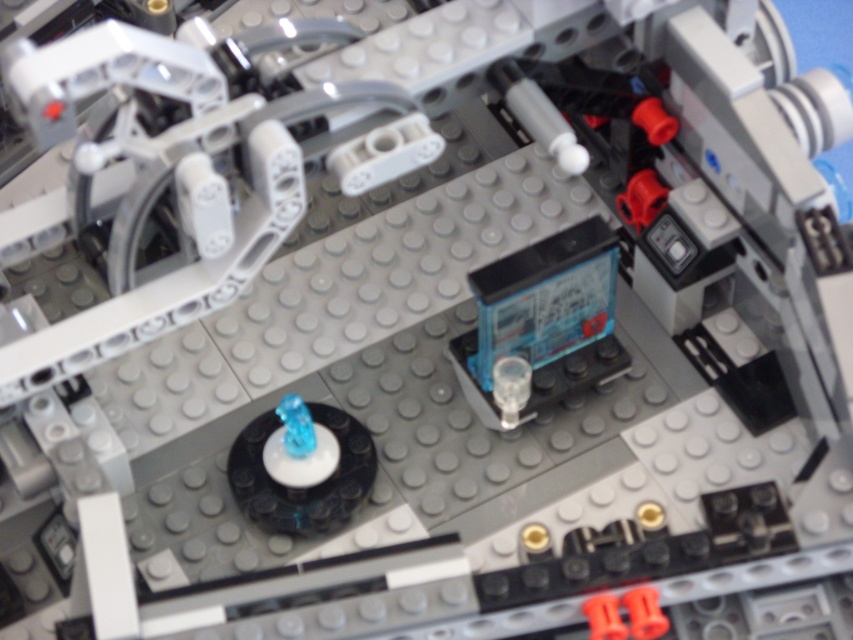
You are assembling a LEGO set and need to place the blue plastic battery at center and the translucent blue plastic bear at center. According to the instructions, which object should be placed first if the battery needs to be above the bear?

The translucent blue plastic bear at center should be placed first because the blue plastic battery at center is located above it, so the bear needs to be positioned below to support the battery.

You are a small robot that needs to recharge its battery. You see a blue plastic battery at center and a translucent blue plastic bear at center in the LEGO construction. Which object is closer to you if you are standing at the edge of the LEGO base?

The blue plastic battery at center is closer to you because it is positioned at the center of the LEGO base, while the translucent blue plastic bear at center is 9.68 inches away from the battery, making it farther from the edge where you are standing.

Looking at this image, you are a child trying to reach the blue plastic battery at center and the translucent blue plastic bear at center in the LEGO set. Which object is closer to you?

The blue plastic battery at center is closer to you because the translucent blue plastic bear at center is behind it.